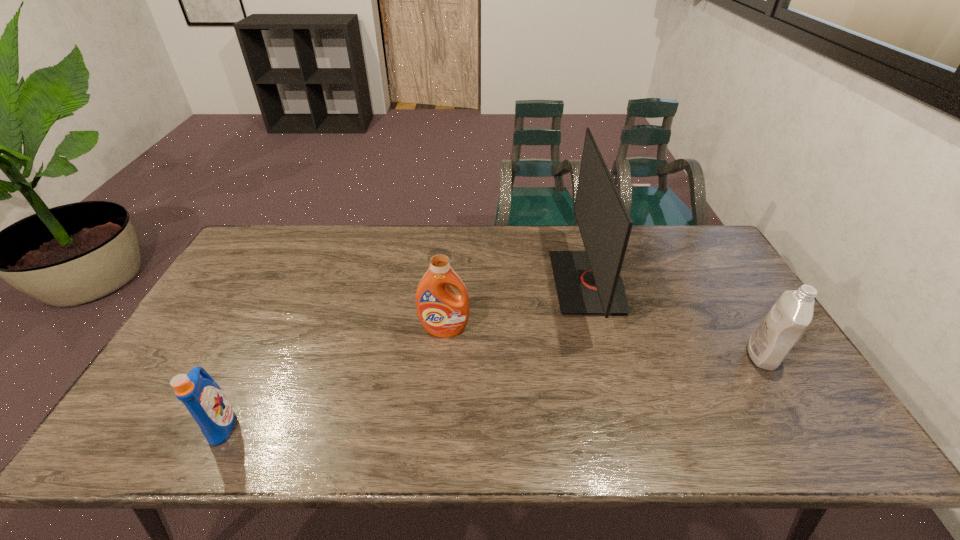
Where is `vacant space at the right edge of the desktop`? vacant space at the right edge of the desktop is located at coordinates (756, 308).

In the image, there is a desktop. At what (x,y) coordinates should I click in order to perform the action: click on free space at the far left corner. Please return your answer as a coordinate pair (x, y). Looking at the image, I should click on (286, 257).

Where is `vacant space at the near left corner of the desktop`? The height and width of the screenshot is (540, 960). vacant space at the near left corner of the desktop is located at coordinates (132, 451).

Locate an element on the screen. The width and height of the screenshot is (960, 540). vacant space at the far right corner of the desktop is located at coordinates (700, 254).

Find the location of a particular element. This screenshot has width=960, height=540. vacant area that lies between the second detergent from left to right and the monitor is located at coordinates (516, 306).

At what (x,y) coordinates should I click in order to perform the action: click on empty location between the monitor and the farthest detergent. Please return your answer as a coordinate pair (x, y). This screenshot has height=540, width=960. Looking at the image, I should click on (516, 306).

The width and height of the screenshot is (960, 540). Identify the location of free point between the tallest object and the second detergent from left to right. (516, 306).

Identify the location of vacant point located between the second detergent from left to right and the rightmost detergent. (604, 342).

At what (x,y) coordinates should I click in order to perform the action: click on free space between the farthest detergent and the tallest object. Please return your answer as a coordinate pair (x, y). The width and height of the screenshot is (960, 540). Looking at the image, I should click on (516, 306).

The image size is (960, 540). In order to click on vacant point located between the tallest object and the leftmost object in this screenshot , I will do `click(405, 353)`.